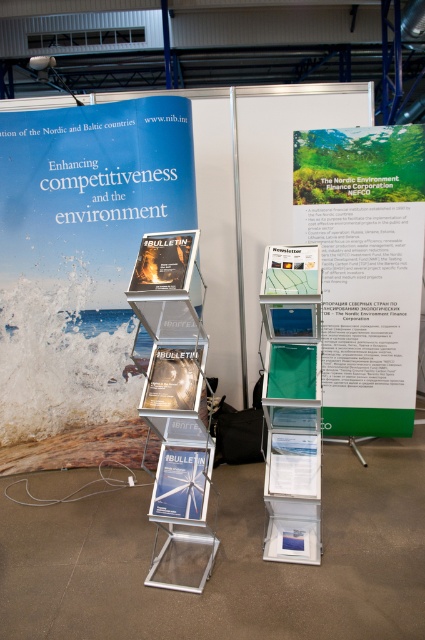
You are standing in front of the display stands at the exhibition. There are two points marked on the bulletin titled BULLETIN. One point is at coordinates point (164, 486) and the other is at point (268, 273). Which point is closer to you?

Point (164, 486) is further to the camera than point (268, 273), so the point closer to you is point (268, 273).

What is the spatial relationship between the matte white poster at center and the green glossy newsletter at center?

The matte white poster at center is closer to the viewer than the green glossy newsletter at center.

Where is the blue paper poster at center located in the image?

The blue paper poster at center is located at point (93, 189) in the image.